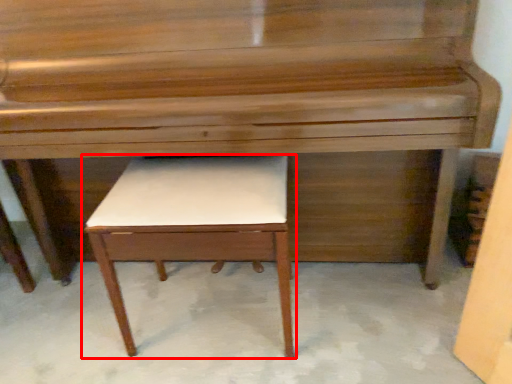
Question: From the image, what is the correct spatial relationship of table (annotated by the red box) in relation to piano?

Choices:
 (A) right
 (B) left

Answer: (B)